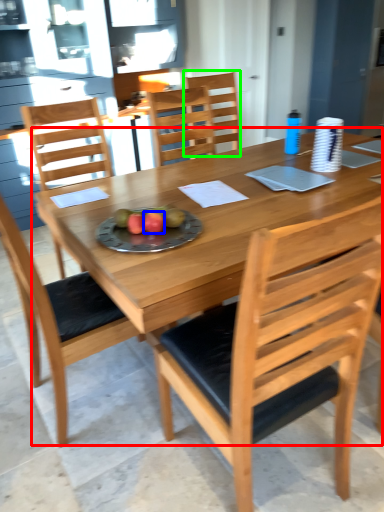
Question: Estimate the real-world distances between objects in this image. Which object is closer to kitchen & dining room table (highlighted by a red box), fruit (highlighted by a blue box) or chair (highlighted by a green box)?

Choices:
 (A) fruit
 (B) chair

Answer: (A)